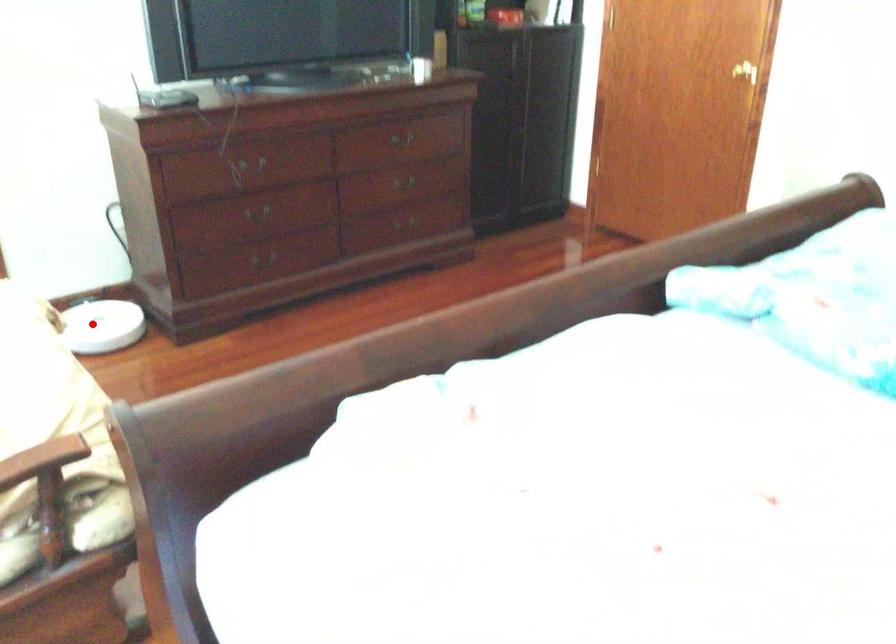
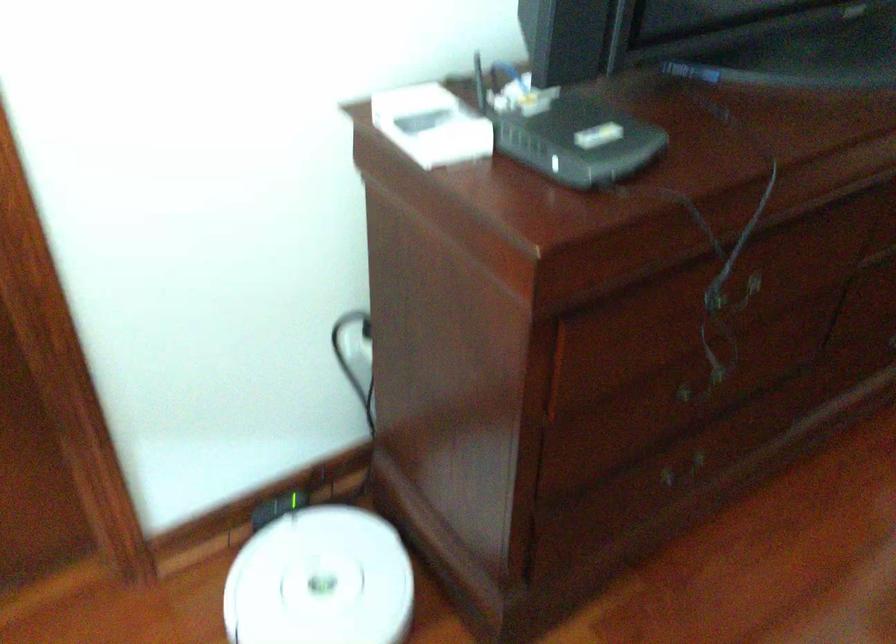
Question: I am providing you with two images of the same scene from different viewpoints. A red point is shown in image1. For the corresponding object point in image2, is it positioned nearer or farther from the camera?

Choices:
 (A) Nearer
 (B) Farther

Answer: (A)